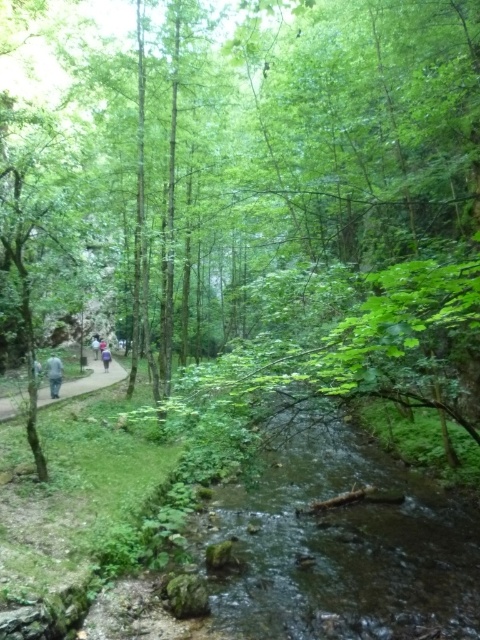
Based on the photo, you are a hiker who wants to cross the clear water stream at center. The stream is at point 0.850, 0.715. If you are standing at point 0.850, 0.715, can you cross the stream?

The clear water stream at center is located at point (343, 544). If you are already standing at that point, you are already at the stream and can proceed to cross it.

You are a hiker standing on the narrow path on the left side of the image. You want to cross the stream to reach the opposite side. Which direction should you walk to first locate the clear water stream at center and the light blue shirt at center before crossing?

You should walk towards the center of the image first to locate the clear water stream at center, since it is to the right of the light blue shirt at center, so you need to pass the light blue shirt at center before reaching the stream.

You are a hiker trying to cross the stream in the forest. You see the green leafy path at left and the light blue shirt at center. Which path is wider for you to walk on?

The green leafy path at left is wider than the light blue shirt at center, so you should choose the green leafy path at left for crossing the stream.